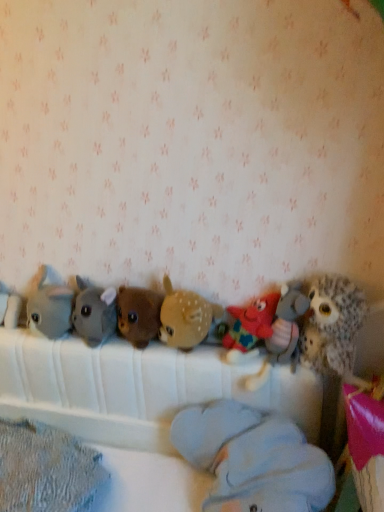
Question: From the image's perspective, is multicolored plush starfish at center, marked as the 8th toy in a left-to-right arrangement, on white plush elephant at left, which ranks as the first toy in left-to-right order?

Choices:
 (A) yes
 (B) no

Answer: (B)

Question: Is multicolored plush starfish at center, marked as the 8th toy in a left-to-right arrangement, looking in the opposite direction of white plush elephant at left, which ranks as the first toy in left-to-right order?

Choices:
 (A) no
 (B) yes

Answer: (A)

Question: Is multicolored plush starfish at center, marked as the 8th toy in a left-to-right arrangement, positioned before white plush elephant at left, which ranks as the first toy in left-to-right order?

Choices:
 (A) no
 (B) yes

Answer: (B)

Question: Is multicolored plush starfish at center, marked as the 8th toy in a left-to-right arrangement, directly adjacent to white plush elephant at left, positioned as the 9th toy in right-to-left order?

Choices:
 (A) no
 (B) yes

Answer: (A)

Question: Does multicolored plush starfish at center, marked as the 8th toy in a left-to-right arrangement, come behind white plush elephant at left, which ranks as the first toy in left-to-right order?

Choices:
 (A) yes
 (B) no

Answer: (B)

Question: Does multicolored plush starfish at center, marked as the second toy in a right-to-left arrangement, have a lesser width compared to white plush elephant at left, positioned as the 9th toy in right-to-left order?

Choices:
 (A) yes
 (B) no

Answer: (B)

Question: Would you say multicolored plush starfish at center, marked as the second toy in a right-to-left arrangement, is part of white plush elephant at left, positioned as the 9th toy in right-to-left order,'s contents?

Choices:
 (A) no
 (B) yes

Answer: (A)

Question: Considering the relative positions of white plush elephant at left, which ranks as the first toy in left-to-right order, and multicolored plush starfish at center, marked as the second toy in a right-to-left arrangement, in the image provided, is white plush elephant at left, which ranks as the first toy in left-to-right order, in front of multicolored plush starfish at center, marked as the second toy in a right-to-left arrangement,?

Choices:
 (A) yes
 (B) no

Answer: (B)

Question: Is white plush elephant at left, which ranks as the first toy in left-to-right order, bigger than multicolored plush starfish at center, marked as the 8th toy in a left-to-right arrangement?

Choices:
 (A) yes
 (B) no

Answer: (B)

Question: From a real-world perspective, is white plush elephant at left, which ranks as the first toy in left-to-right order, positioned over multicolored plush starfish at center, marked as the 8th toy in a left-to-right arrangement, based on gravity?

Choices:
 (A) yes
 (B) no

Answer: (A)

Question: Considering the relative sizes of white plush elephant at left, positioned as the 9th toy in right-to-left order, and multicolored plush starfish at center, marked as the second toy in a right-to-left arrangement, in the image provided, is white plush elephant at left, positioned as the 9th toy in right-to-left order, shorter than multicolored plush starfish at center, marked as the second toy in a right-to-left arrangement,?

Choices:
 (A) yes
 (B) no

Answer: (A)

Question: From the image's perspective, is white plush elephant at left, which ranks as the first toy in left-to-right order, under multicolored plush starfish at center, marked as the second toy in a right-to-left arrangement?

Choices:
 (A) yes
 (B) no

Answer: (B)

Question: Is fuzzy brown owl at right, which is the ninth toy in left-to-right order, at the right side of soft gray plush at center, the third toy in the left-to-right sequence?

Choices:
 (A) no
 (B) yes

Answer: (B)